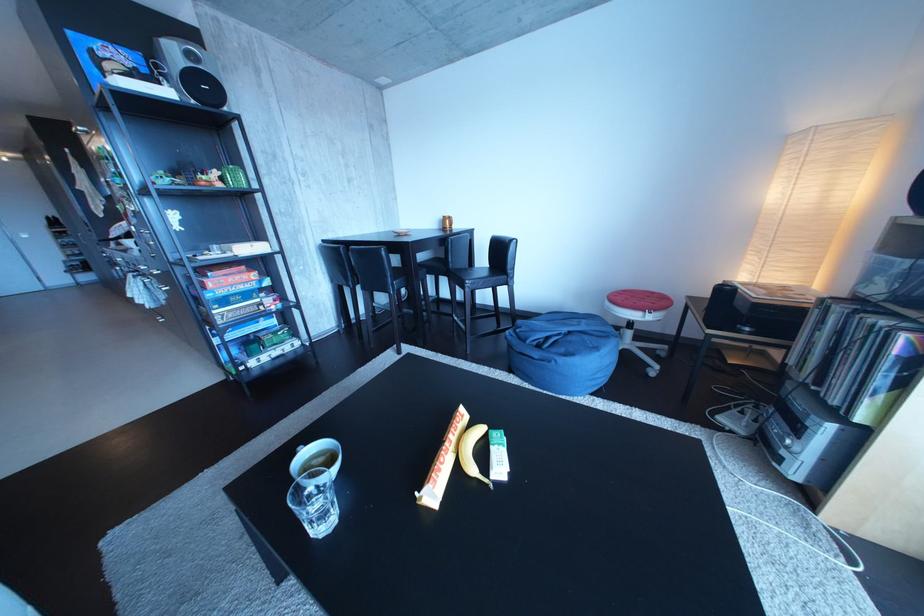
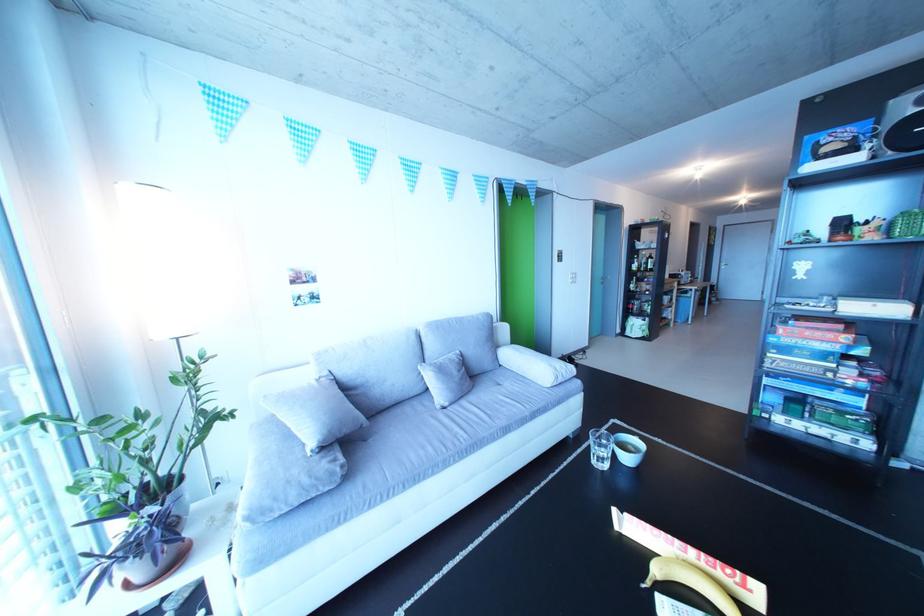
The point at (450, 513) is marked in the first image. Where is the corresponding point in the second image?

(630, 533)